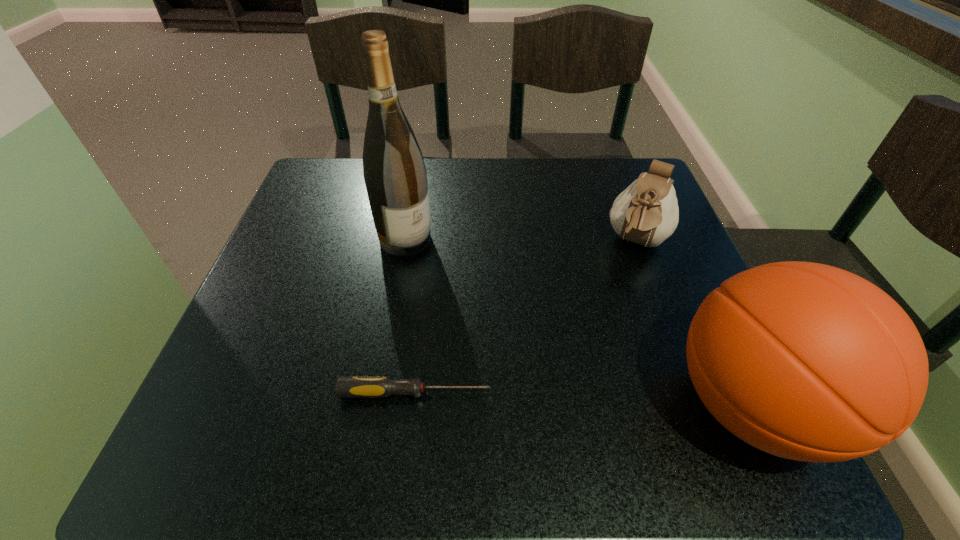
Identify the location of the shortest object. This screenshot has height=540, width=960. (347, 386).

Where is `basketball`? basketball is located at coordinates (805, 361).

Locate an element on the screen. The image size is (960, 540). the second shortest object is located at coordinates (646, 212).

Identify the location of the tallest object. The image size is (960, 540). (394, 172).

I want to click on free space located insert the shortest object into a screw head, so tap(552, 393).

Locate an element on the screen. The image size is (960, 540). free spot located on the back of the basketball is located at coordinates (695, 285).

Find the location of a particular element. Image resolution: width=960 pixels, height=540 pixels. free region located 0.250m on the front-facing side of the second shortest object is located at coordinates 595,351.

The width and height of the screenshot is (960, 540). Find the location of `vacant region located on the front-facing side of the second shortest object`. vacant region located on the front-facing side of the second shortest object is located at coordinates (605, 327).

Locate an element on the screen. Image resolution: width=960 pixels, height=540 pixels. vacant space situated 0.090m on the front-facing side of the second shortest object is located at coordinates (618, 291).

You are a GUI agent. You are given a task and a screenshot of the screen. Output one action in this format:
    pyautogui.click(x=<x>, y=<y>)
    Task: Click on the free point located 0.310m on the label of the tallest object
    
    Given the screenshot: What is the action you would take?
    pyautogui.click(x=530, y=339)